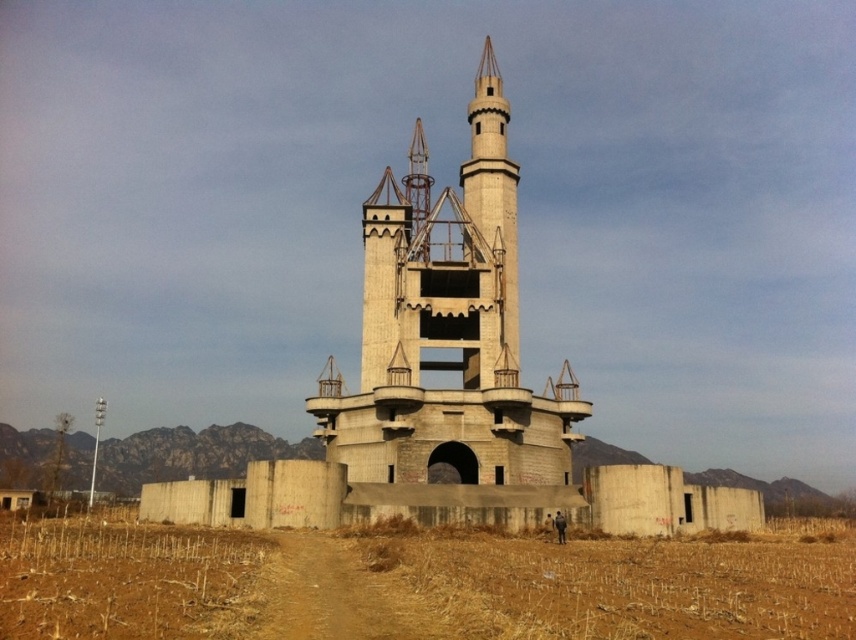
You are a delivery drone with a maximum flight range of 30 meters. You need to deliver a package to the concrete tower at center from the brown dirt track at lower center. Can you complete the delivery without needing to recharge?

The distance between the concrete tower at center and the brown dirt track at lower center is 27.36 meters, which is within your 30 meter range. Yes, you can complete the delivery without needing to recharge.

You are standing at the edge of the open field and see the brown dry grass at lower center and the concretecastle at center. Which object is wider from your perspective?

The brown dry grass at lower center might be wider than the concretecastle at center according to the description.